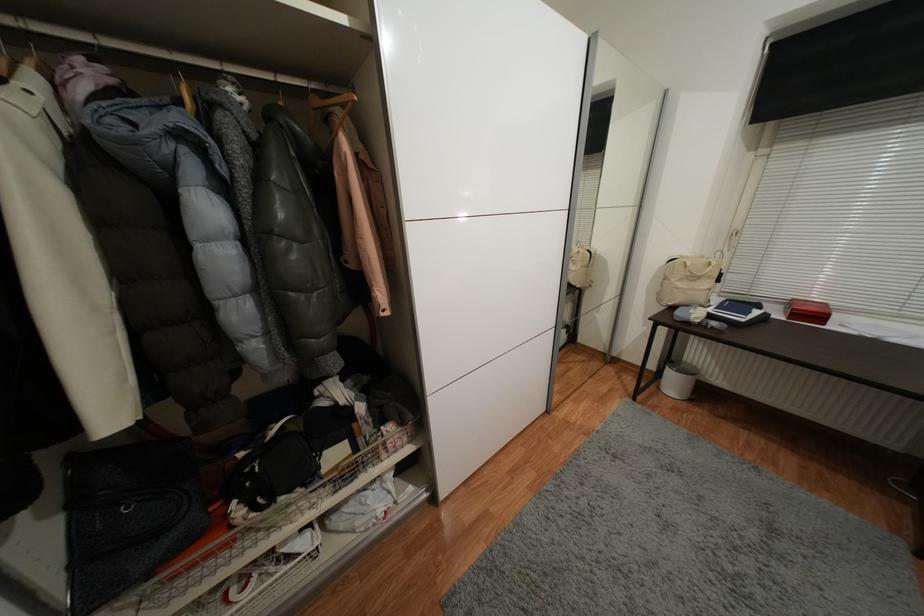
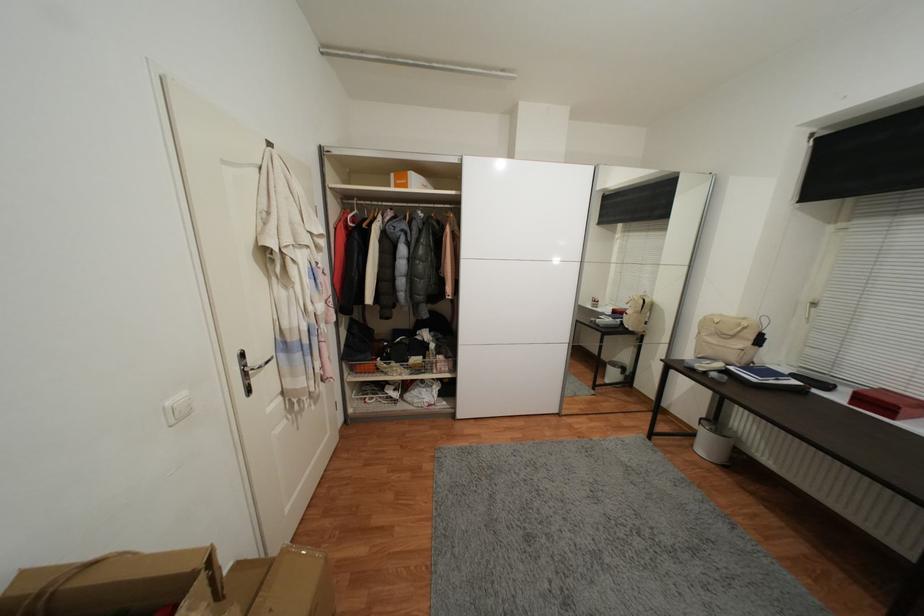
Find the pixel in the second image that matches (663,390) in the first image.

(697, 447)